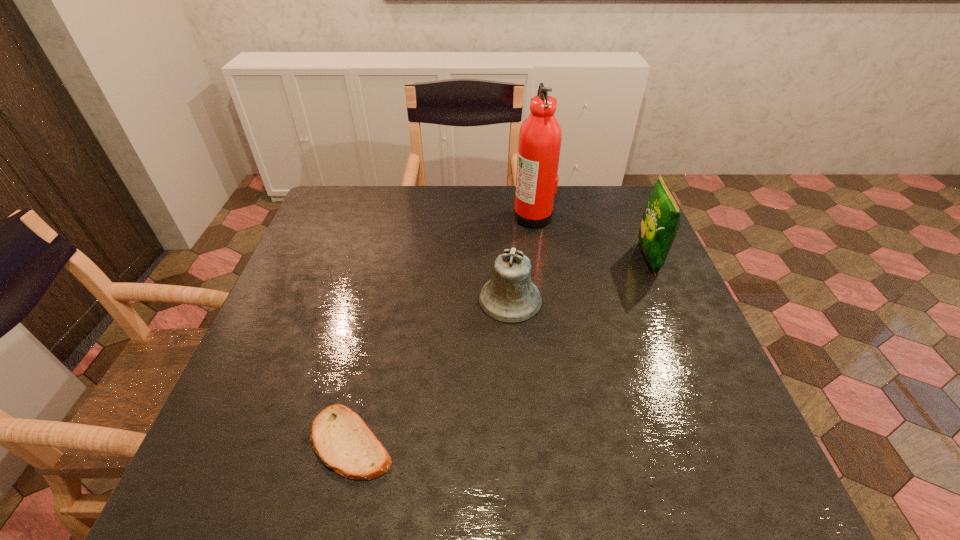
At what (x,y) coordinates should I click in order to perform the action: click on vacant space at the near edge of the desktop. Please return your answer as a coordinate pair (x, y). The height and width of the screenshot is (540, 960). Looking at the image, I should click on (488, 477).

Locate an element on the screen. The height and width of the screenshot is (540, 960). free space at the left edge is located at coordinates (300, 255).

At what (x,y) coordinates should I click in order to perform the action: click on free space at the right edge. Please return your answer as a coordinate pair (x, y). Looking at the image, I should click on (630, 251).

At what (x,y) coordinates should I click in order to perform the action: click on vacant region at the far left corner of the desktop. Please return your answer as a coordinate pair (x, y). Looking at the image, I should click on (341, 189).

What are the coordinates of `vacant space at the near left corner of the desktop` in the screenshot? It's located at (189, 489).

In the image, there is a desktop. What are the coordinates of `vacant region at the far right corner` in the screenshot? It's located at (591, 189).

Find the location of `free space between the crisp (potato chip) and the second shortest object`. free space between the crisp (potato chip) and the second shortest object is located at coordinates (579, 279).

The width and height of the screenshot is (960, 540). Identify the location of vacant region between the second nearest object and the pita bread. (431, 370).

This screenshot has width=960, height=540. I want to click on vacant area that lies between the shortest object and the fire extinguisher, so click(x=442, y=329).

Where is `vacant space in between the second shortest object and the nearest object`? The height and width of the screenshot is (540, 960). vacant space in between the second shortest object and the nearest object is located at coordinates (431, 370).